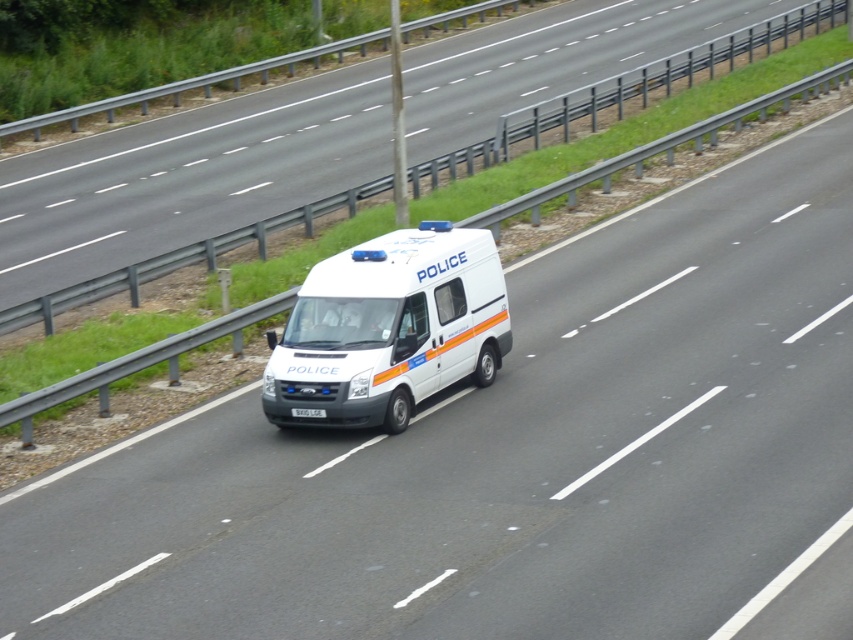
Which of these two, white matte van at center or white glossy van at center, stands shorter?

white matte van at center

Which is behind, point (450, 305) or point (286, 212)?

Point (286, 212)

You are a GUI agent. You are given a task and a screenshot of the screen. Output one action in this format:
    pyautogui.click(x=<x>, y=<y>)
    Task: Click on the white matte van at center
    
    Given the screenshot: What is the action you would take?
    pyautogui.click(x=389, y=328)

Does point (419, 376) come behind point (296, 416)?

That is True.

This screenshot has height=640, width=853. Describe the element at coordinates (389, 328) in the screenshot. I see `white matte van at center` at that location.

Find the location of a particular element. The height and width of the screenshot is (640, 853). white matte van at center is located at coordinates (389, 328).

Between point (817, 12) and point (314, 410), which one is positioned in front?

Positioned in front is point (314, 410).

Between white glossy van at center and white plastic license plate at center, which one is positioned higher?

white glossy van at center is above.

The width and height of the screenshot is (853, 640). What do you see at coordinates (637, 83) in the screenshot?
I see `white glossy van at center` at bounding box center [637, 83].

Locate an element on the screen. This screenshot has width=853, height=640. white glossy van at center is located at coordinates (637, 83).